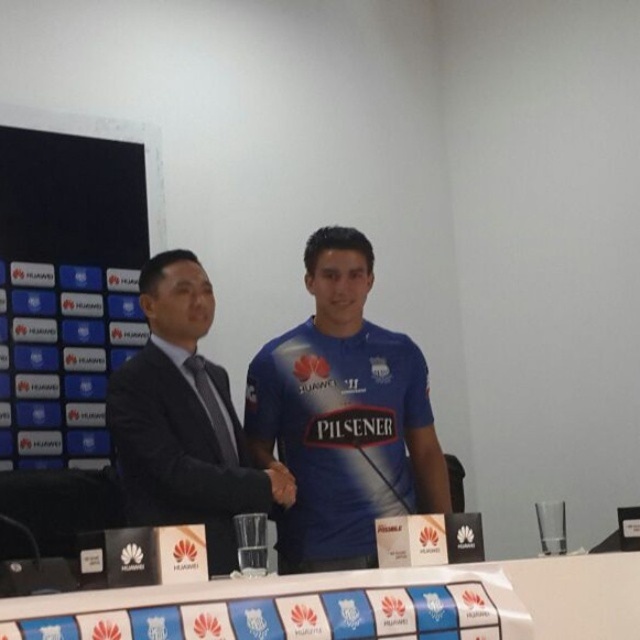
Is dark blue suit at center thinner than white glossy table at center?

Yes, dark blue suit at center is thinner than white glossy table at center.

Which is behind, point (216, 364) or point (541, 566)?

Point (216, 364)

Who is more distant from viewer, (157, 502) or (572, 636)?

The point (157, 502) is behind.

You are a GUI agent. You are given a task and a screenshot of the screen. Output one action in this format:
    pyautogui.click(x=<x>, y=<y>)
    Task: Click on the dark blue suit at center
    This screenshot has width=640, height=640.
    Given the screenshot: What is the action you would take?
    pyautogui.click(x=180, y=417)

Is point (317, 531) positioned before point (161, 602)?

No, (317, 531) is behind (161, 602).

Who is more forward, (387, 404) or (545, 595)?

Positioned in front is point (545, 595).

The image size is (640, 640). What do you see at coordinates (342, 413) in the screenshot? I see `blue jersey at center` at bounding box center [342, 413].

Where is `blue jersey at center`? This screenshot has height=640, width=640. blue jersey at center is located at coordinates (342, 413).

Can you confirm if white glossy table at center is positioned to the left of black matte hand at center?

In fact, white glossy table at center is to the right of black matte hand at center.

Which of these two, white glossy table at center or black matte hand at center, stands taller?

With more height is white glossy table at center.

Does point (472, 570) come closer to viewer compared to point (273, 492)?

Yes, point (472, 570) is closer to viewer.

Find the location of a particular element. white glossy table at center is located at coordinates coord(422,582).